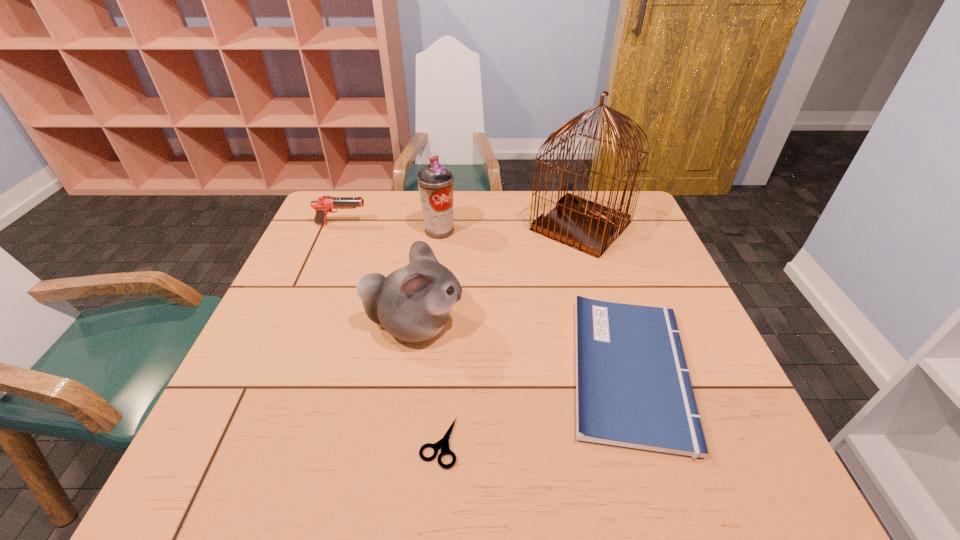
You are a GUI agent. You are given a task and a screenshot of the screen. Output one action in this format:
    pyautogui.click(x=<x>, y=<y>)
    Task: Click on the vacant area located 0.210m at the aiming end of the gun
    The height and width of the screenshot is (540, 960).
    Given the screenshot: What is the action you would take?
    pyautogui.click(x=436, y=224)

This screenshot has width=960, height=540. Find the location of `free spot located on the back of the paperback book`. free spot located on the back of the paperback book is located at coordinates (584, 223).

Where is `free region located on the back of the shortest object`? The image size is (960, 540). free region located on the back of the shortest object is located at coordinates (447, 329).

In order to click on birdcage present at the far edge in this screenshot , I will do `click(590, 227)`.

This screenshot has height=540, width=960. Find the location of `aerosol can that is at the far edge`. aerosol can that is at the far edge is located at coordinates (435, 182).

The image size is (960, 540). In order to click on gun positioned at the far edge in this screenshot , I will do `click(324, 205)`.

The height and width of the screenshot is (540, 960). What are the coordinates of `paperback book located at the near edge` in the screenshot? It's located at (633, 389).

Locate an element on the screen. The width and height of the screenshot is (960, 540). shears that is at the near edge is located at coordinates (443, 444).

Where is `object at the left edge`? The height and width of the screenshot is (540, 960). object at the left edge is located at coordinates (324, 205).

The height and width of the screenshot is (540, 960). In order to click on birdcage positioned at the right edge in this screenshot , I will do `click(590, 227)`.